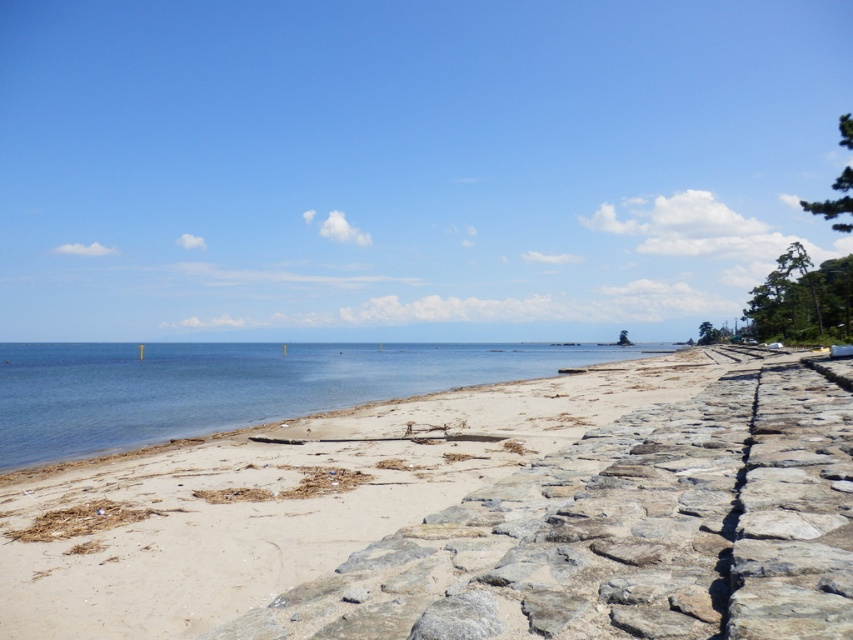
You are a beachcomber searching for treasures on the light brown sand at lower left and the blue water at center. Which area covers a smaller portion of the image?

The light brown sand at lower left occupies less space than the blue water at center, so it covers a smaller portion of the image.

You are standing on the beach looking at the two points marked in the image. Which point, point (242,608) or point (283,416), is closer to you?

Point (242,608) is closer to the viewer than point (283,416).

You are standing on the light brown sand at lower left and want to reach the blue water at center. Which direction should you move to get there?

You should move downward because the light brown sand at lower left is above the blue water at center, so moving downward will take you towards the blue water at center.